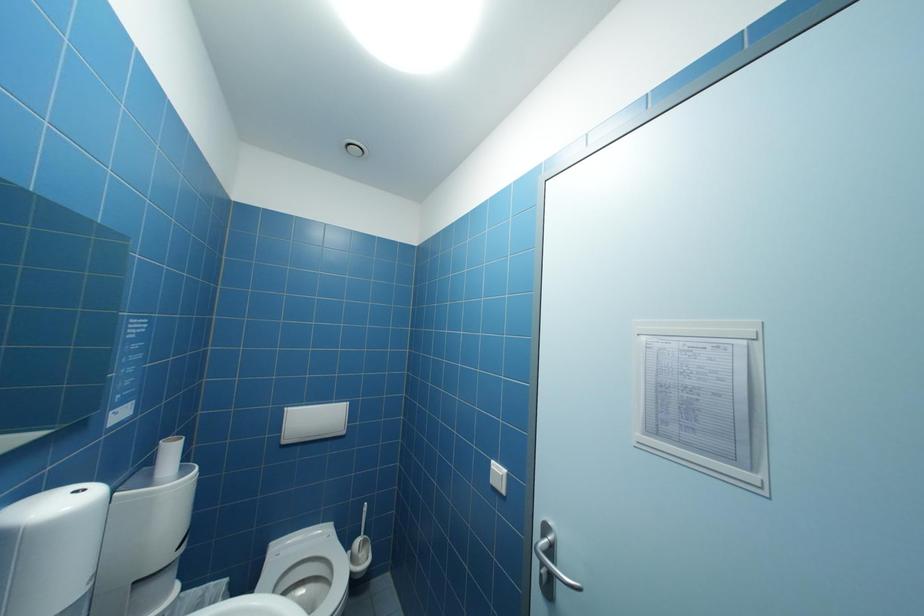
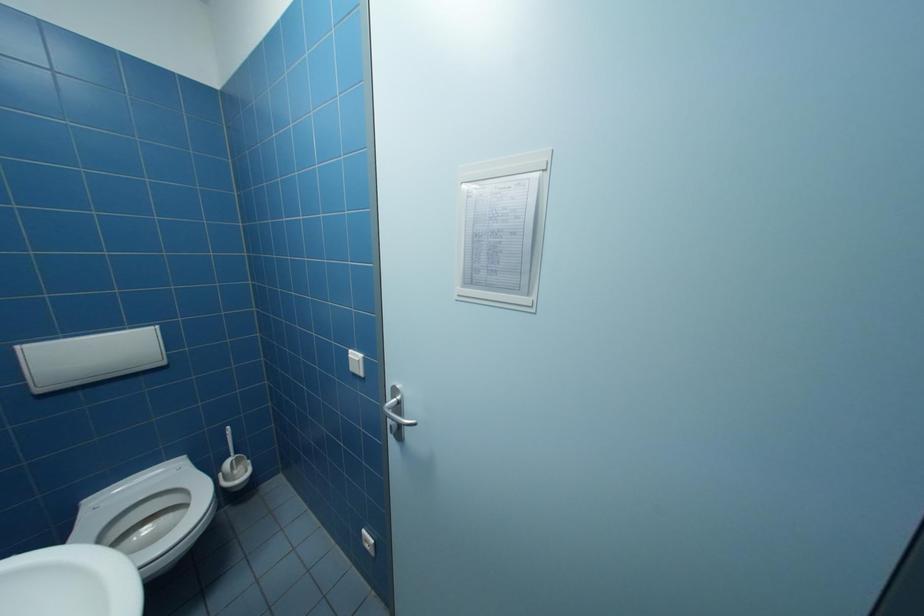
Question: In a continuous first-person perspective shot, in which direction is the camera moving?

Choices:
 (A) Left
 (B) Right
 (C) Forward
 (D) Backward

Answer: (B)